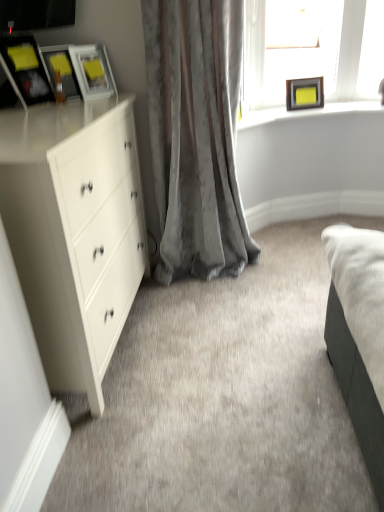
The height and width of the screenshot is (512, 384). I want to click on vacant area that is situated to the right of matte black picture frame at upper left, which appears as the fourth picture frame when viewed from the right, so click(x=69, y=104).